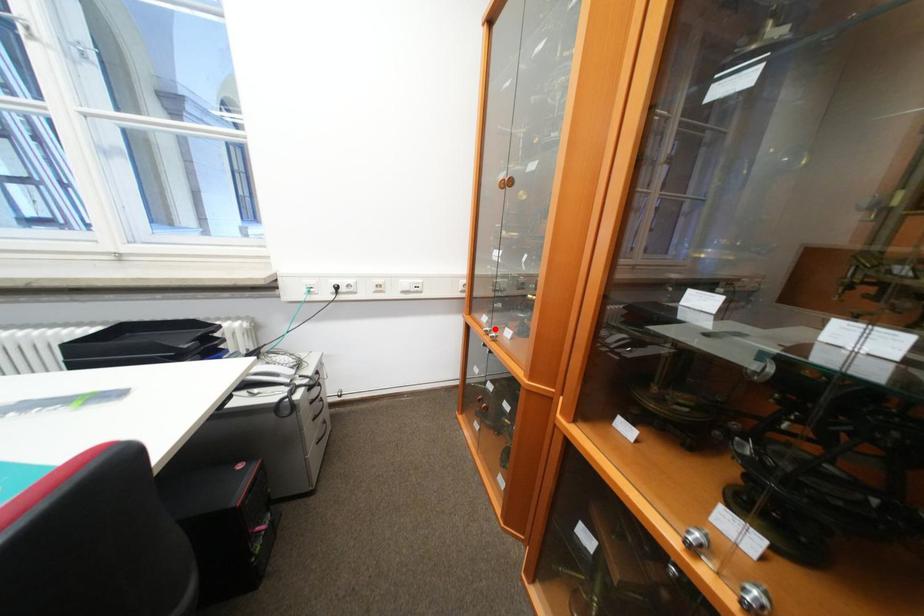
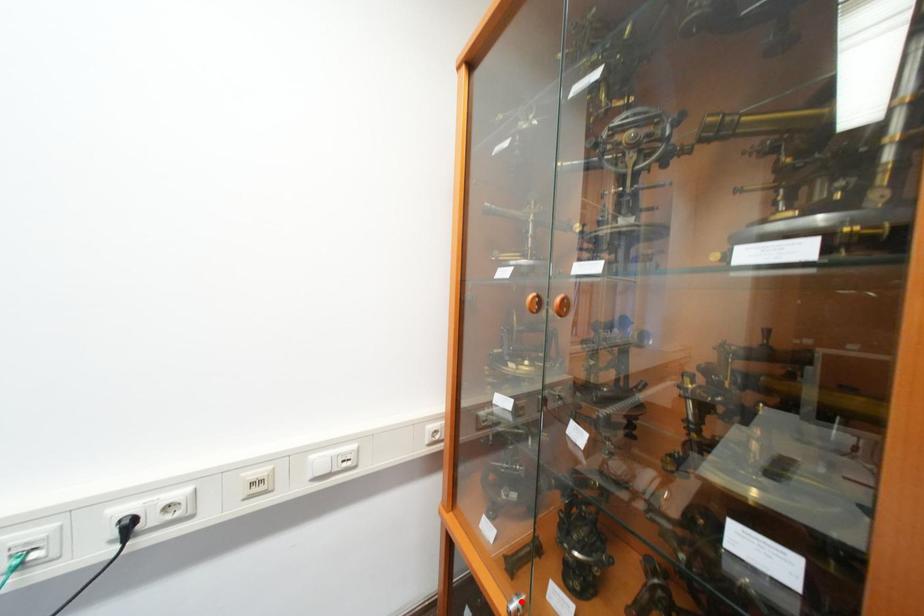
I am providing you with two images of the same scene from different viewpoints. A red point is marked on the first image and another point is marked on the second image. Is the red point in image1 aligned with the point shown in image2?

Yes